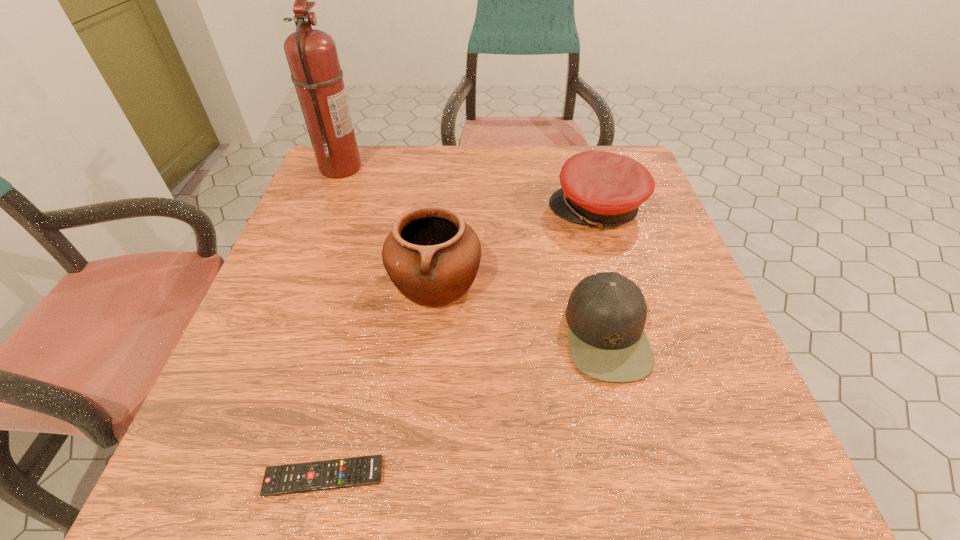
In order to click on free space located on the front of the second farthest object with an emblem in this screenshot , I will do `click(464, 210)`.

Find the location of a particular element. This screenshot has height=540, width=960. vacant region located 0.350m on the front of the second farthest object with an emblem is located at coordinates (406, 210).

At what (x,y) coordinates should I click in order to perform the action: click on vacant position located on the brim of the nearer cap. Please return your answer as a coordinate pair (x, y). The image size is (960, 540). Looking at the image, I should click on (458, 334).

The width and height of the screenshot is (960, 540). In order to click on vacant space located 0.320m on the brim of the nearer cap in this screenshot , I will do `click(394, 334)`.

This screenshot has width=960, height=540. I want to click on free space located on the brim of the nearer cap, so (x=529, y=334).

Identify the location of vacant space located on the back of the remote control. The image size is (960, 540). (356, 342).

You are a GUI agent. You are given a task and a screenshot of the screen. Output one action in this format:
    pyautogui.click(x=<x>, y=<y>)
    Task: Click on the fire extinguisher located at the far edge
    
    Given the screenshot: What is the action you would take?
    pyautogui.click(x=312, y=56)

You are a GUI agent. You are given a task and a screenshot of the screen. Output one action in this format:
    pyautogui.click(x=<x>, y=<y>)
    Task: Click on the cap that is positioned at the far edge
    
    Given the screenshot: What is the action you would take?
    pyautogui.click(x=603, y=189)

Locate an element on the screen. object located at the near edge is located at coordinates (339, 473).

Locate an element on the screen. This screenshot has width=960, height=540. fire extinguisher that is at the left edge is located at coordinates (312, 56).